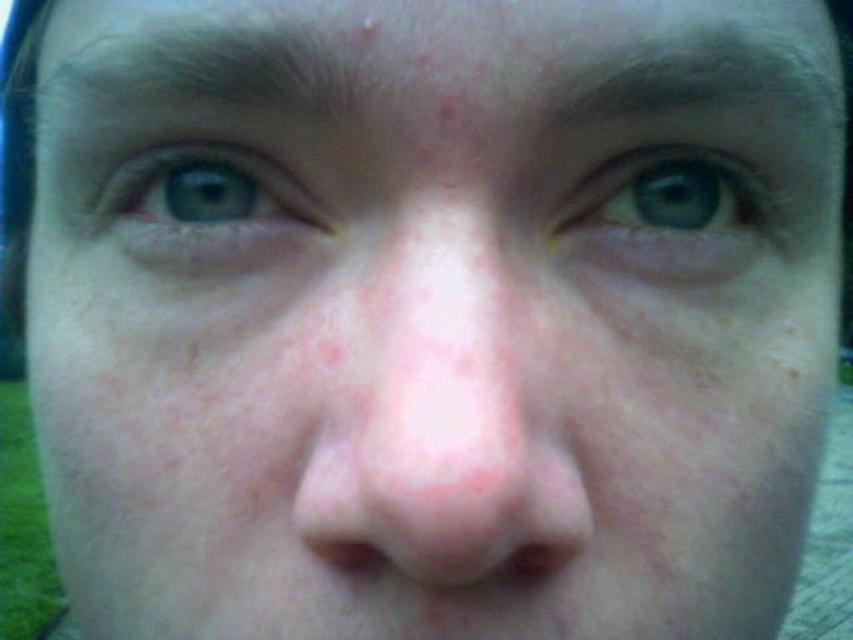
Question: Among these points, which one is farthest from the camera?

Choices:
 (A) (325, 253)
 (B) (508, 566)
 (C) (42, 80)
 (D) (659, 93)

Answer: (C)

Question: Is pink smooth nose at center bigger than pink flesh-colored nose at center?

Choices:
 (A) no
 (B) yes

Answer: (B)

Question: Is brown hair at upper center above pink flesh-colored nose at center?

Choices:
 (A) no
 (B) yes

Answer: (B)

Question: From the image, what is the correct spatial relationship of pink smooth nose at center in relation to brown hair at upper center?

Choices:
 (A) above
 (B) below

Answer: (B)

Question: Which object is positioned farthest from the pink flesh-colored nose at center?

Choices:
 (A) green matte eye at upper left
 (B) brown hair at upper center
 (C) dark brown hair at upper center

Answer: (B)

Question: Which point is farther to the camera?

Choices:
 (A) (252, 204)
 (B) (167, 56)
 (C) (320, 337)

Answer: (A)